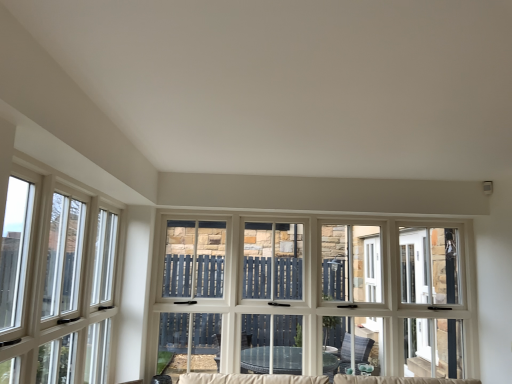
Question: Which direction should I rotate to look at white wood window at center, which is the 1th window from right to left?

Choices:
 (A) right
 (B) left

Answer: (A)

Question: Considering the relative positions of white wood window at center, arranged as the first window when viewed from the back, and clear glass window at left, which is the second window in back-to-front order, in the image provided, is white wood window at center, arranged as the first window when viewed from the back, to the right of clear glass window at left, which is the second window in back-to-front order, from the viewer's perspective?

Choices:
 (A) no
 (B) yes

Answer: (B)

Question: Is white wood window at center, which is counted as the second window, starting from the left, shorter than clear glass window at left, which is counted as the first window, starting from the left?

Choices:
 (A) no
 (B) yes

Answer: (A)

Question: Is white wood window at center, the second window when ordered from front to back, thinner than clear glass window at left, which is counted as the first window, starting from the left?

Choices:
 (A) yes
 (B) no

Answer: (B)

Question: From a real-world perspective, is white wood window at center, which is counted as the second window, starting from the left, positioned under clear glass window at left, which is counted as the first window, starting from the left, based on gravity?

Choices:
 (A) yes
 (B) no

Answer: (A)

Question: Is white wood window at center, the second window when ordered from front to back, directly adjacent to clear glass window at left, which is the second window in back-to-front order?

Choices:
 (A) yes
 (B) no

Answer: (B)

Question: Does white wood window at center, arranged as the first window when viewed from the back, have a larger size compared to clear glass window at left, which is counted as the first window, starting from the left?

Choices:
 (A) no
 (B) yes

Answer: (B)

Question: From a real-world perspective, does clear glass window at left, which is counted as the first window, starting from the left, stand above white wood window at center, which is counted as the second window, starting from the left?

Choices:
 (A) yes
 (B) no

Answer: (A)

Question: Is white wood window at center, arranged as the first window when viewed from the back, at the back of clear glass window at left, which is counted as the first window, starting from the left?

Choices:
 (A) yes
 (B) no

Answer: (B)

Question: Is clear glass window at left, which appears as the 2th window when viewed from the right, behind white wood window at center, which is counted as the second window, starting from the left?

Choices:
 (A) no
 (B) yes

Answer: (A)

Question: Is clear glass window at left, placed as the first window when sorted from front to back, closer to the viewer compared to white wood window at center, which is the 1th window from right to left?

Choices:
 (A) no
 (B) yes

Answer: (B)

Question: From the image's perspective, is clear glass window at left, placed as the first window when sorted from front to back, above white wood window at center, the second window when ordered from front to back?

Choices:
 (A) no
 (B) yes

Answer: (B)

Question: Can you see clear glass window at left, placed as the first window when sorted from front to back, touching white wood window at center, which is the 1th window from right to left?

Choices:
 (A) no
 (B) yes

Answer: (A)

Question: Looking at their shapes, would you say white wood window at center, which is the 1th window from right to left, is wider or thinner than clear glass window at left, which is counted as the first window, starting from the left?

Choices:
 (A) wide
 (B) thin

Answer: (A)